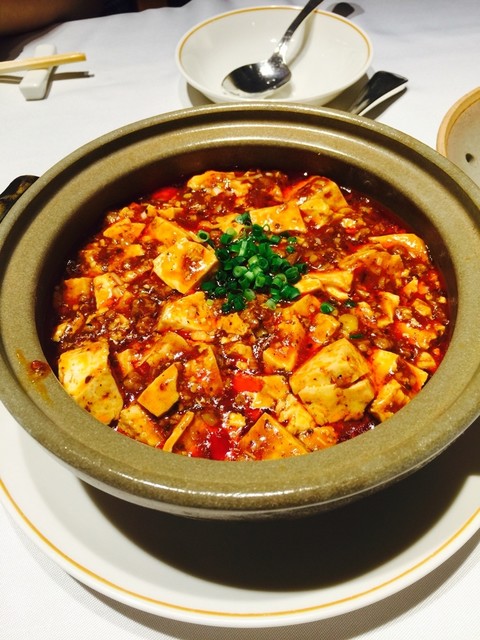
Locate an element on the screen. white bowl is located at coordinates [x=472, y=130].